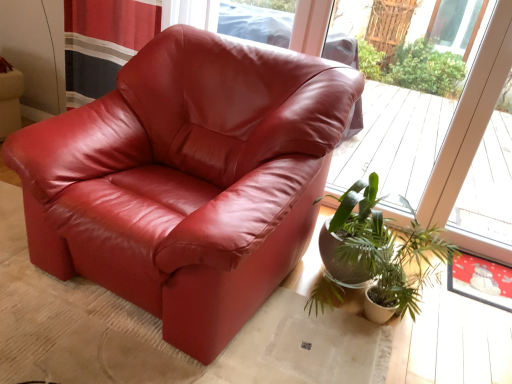
Question: From a real-world perspective, is green leafy plant at lower right located higher than transparent glass window at upper center?

Choices:
 (A) no
 (B) yes

Answer: (A)

Question: Is transparent glass window at upper center a part of green leafy plant at lower right?

Choices:
 (A) no
 (B) yes

Answer: (A)

Question: Is green leafy plant at lower right positioned before transparent glass window at upper center?

Choices:
 (A) no
 (B) yes

Answer: (B)

Question: Considering the relative sizes of green leafy plant at lower right and transparent glass window at upper center in the image provided, is green leafy plant at lower right smaller than transparent glass window at upper center?

Choices:
 (A) no
 (B) yes

Answer: (B)

Question: Is green leafy plant at lower right next to transparent glass window at upper center and touching it?

Choices:
 (A) yes
 (B) no

Answer: (B)

Question: Considering the positions of transparent glass window at upper center and green leafy plant at lower right in the image, is transparent glass window at upper center taller or shorter than green leafy plant at lower right?

Choices:
 (A) tall
 (B) short

Answer: (A)

Question: Does point (485, 170) appear closer or farther from the camera than point (437, 233)?

Choices:
 (A) farther
 (B) closer

Answer: (A)

Question: Would you say transparent glass window at upper center is inside or outside green leafy plant at lower right?

Choices:
 (A) outside
 (B) inside

Answer: (A)

Question: Is transparent glass window at upper center to the left or to the right of green leafy plant at lower right in the image?

Choices:
 (A) left
 (B) right

Answer: (B)

Question: Would you say green leafy plant at lower right is to the left or to the right of transparent glass window at upper center in the picture?

Choices:
 (A) left
 (B) right

Answer: (A)

Question: Is green leafy plant at lower right situated inside transparent glass window at upper center or outside?

Choices:
 (A) inside
 (B) outside

Answer: (B)

Question: From a real-world perspective, is green leafy plant at lower right positioned above or below transparent glass window at upper center?

Choices:
 (A) above
 (B) below

Answer: (B)

Question: From their relative heights in the image, would you say green leafy plant at lower right is taller or shorter than transparent glass window at upper center?

Choices:
 (A) tall
 (B) short

Answer: (B)

Question: Looking at their shapes, would you say matte leather armchair at center is wider or thinner than green leafy plant at lower right?

Choices:
 (A) wide
 (B) thin

Answer: (A)

Question: Is matte leather armchair at center inside or outside of green leafy plant at lower right?

Choices:
 (A) outside
 (B) inside

Answer: (A)